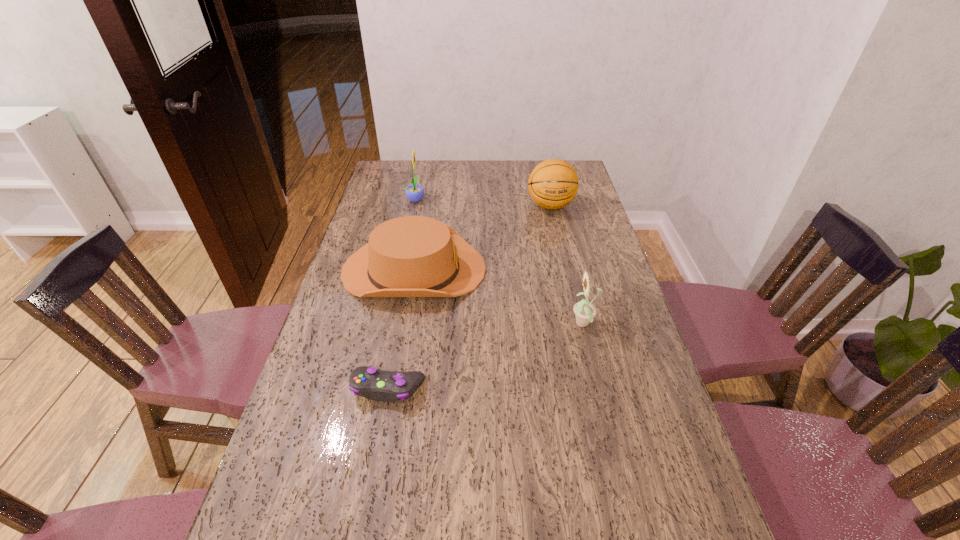
Image resolution: width=960 pixels, height=540 pixels. In the image, there is a desktop. Identify the location of vacant space at the far edge. (420, 180).

In the image, there is a desktop. At what (x,y) coordinates should I click in order to perform the action: click on vacant area at the left edge. Please return your answer as a coordinate pair (x, y). Image resolution: width=960 pixels, height=540 pixels. Looking at the image, I should click on (343, 365).

The height and width of the screenshot is (540, 960). In the image, there is a desktop. Identify the location of blank space at the right edge. (573, 270).

I want to click on free space between the basketball and the right sunflower, so click(x=567, y=265).

Where is `vacant region between the right sunflower and the cowboy hat`? This screenshot has height=540, width=960. vacant region between the right sunflower and the cowboy hat is located at coordinates (499, 297).

You are a GUI agent. You are given a task and a screenshot of the screen. Output one action in this format:
    pyautogui.click(x=<x>, y=<y>)
    Task: Click on the free space between the left sunflower and the nearer sunflower
    This screenshot has height=540, width=960.
    Given the screenshot: What is the action you would take?
    pyautogui.click(x=500, y=262)

Where is `free space between the basketball and the fourth farthest object`? The image size is (960, 540). free space between the basketball and the fourth farthest object is located at coordinates (567, 265).

The image size is (960, 540). In order to click on free space between the basketball and the nearer sunflower in this screenshot , I will do `click(567, 265)`.

You are a GUI agent. You are given a task and a screenshot of the screen. Output one action in this format:
    pyautogui.click(x=<x>, y=<y>)
    Task: Click on the empty space between the basketball and the farther sunflower
    The image size is (960, 540).
    Given the screenshot: What is the action you would take?
    pyautogui.click(x=483, y=202)

At what (x,y) coordinates should I click in order to perform the action: click on vacant region between the nearer sunflower and the basketball. Please return your answer as a coordinate pair (x, y). Image resolution: width=960 pixels, height=540 pixels. Looking at the image, I should click on (567, 265).